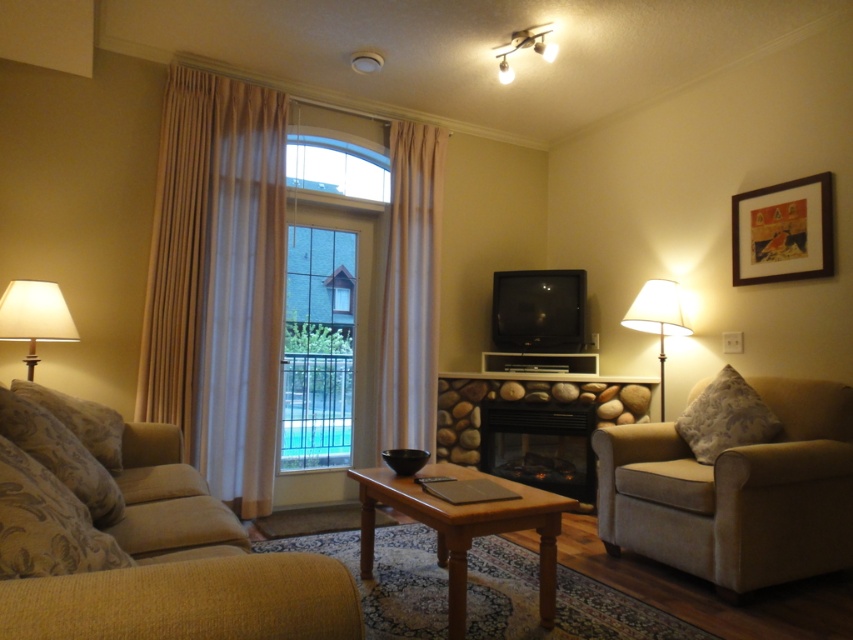
Is beige fabric armchair at right to the right of white fabric lampshade at left from the viewer's perspective?

Correct, you'll find beige fabric armchair at right to the right of white fabric lampshade at left.

Describe the element at coordinates (735, 492) in the screenshot. I see `beige fabric armchair at right` at that location.

Where is `beige fabric armchair at right`? Image resolution: width=853 pixels, height=640 pixels. beige fabric armchair at right is located at coordinates (735, 492).

Can you confirm if beige fabric couch at left is positioned below matte black light fixture at upper center?

Correct, beige fabric couch at left is located below matte black light fixture at upper center.

Does beige fabric couch at left have a smaller size compared to matte black light fixture at upper center?

No, beige fabric couch at left is not smaller than matte black light fixture at upper center.

Identify the location of beige fabric couch at left. Image resolution: width=853 pixels, height=640 pixels. [141, 547].

Find the location of `beige fabric couch at left`. beige fabric couch at left is located at coordinates (141, 547).

Consider the image. Between beige fabric couch at left and light brown wooden coffee table at center, which one is positioned higher?

beige fabric couch at left

The width and height of the screenshot is (853, 640). Identify the location of beige fabric couch at left. (141, 547).